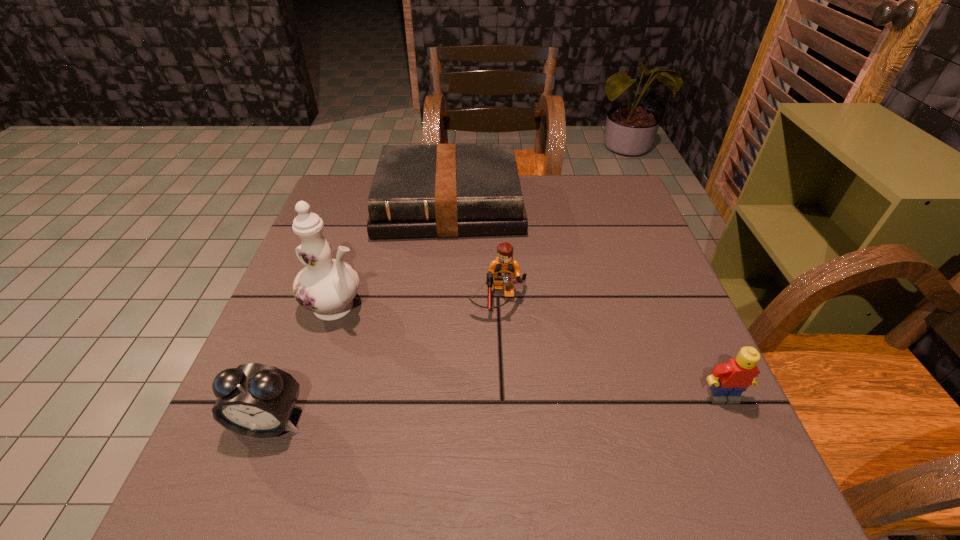
The height and width of the screenshot is (540, 960). Identify the location of alarm clock. (256, 400).

Find the location of `the rightmost object`. the rightmost object is located at coordinates (728, 381).

Locate an element on the screen. The image size is (960, 540). the right Lego is located at coordinates (728, 381).

At what (x,y) coordinates should I click in order to perform the action: click on hardback book. Please return your answer as a coordinate pair (x, y). Looking at the image, I should click on (446, 190).

Image resolution: width=960 pixels, height=540 pixels. Identify the location of the farthest object. (446, 190).

This screenshot has height=540, width=960. I want to click on the left Lego, so click(503, 269).

Where is `chinaware`? chinaware is located at coordinates (326, 286).

Locate an element on the screen. This screenshot has width=960, height=540. vacant area situated on the front-facing side of the rightmost object is located at coordinates (738, 430).

Where is `free space located on the spine side of the farthest object`? free space located on the spine side of the farthest object is located at coordinates (449, 282).

At what (x,y) coordinates should I click in order to perform the action: click on free space located 0.240m on the spine side of the farthest object. Please return your answer as a coordinate pair (x, y). The image size is (960, 540). Looking at the image, I should click on click(449, 310).